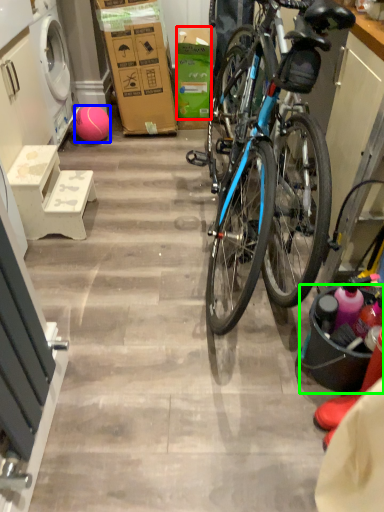
Question: Which is nearer to the box (highlighted by a red box)? ball (highlighted by a blue box) or bucket (highlighted by a green box).

Choices:
 (A) ball
 (B) bucket

Answer: (A)